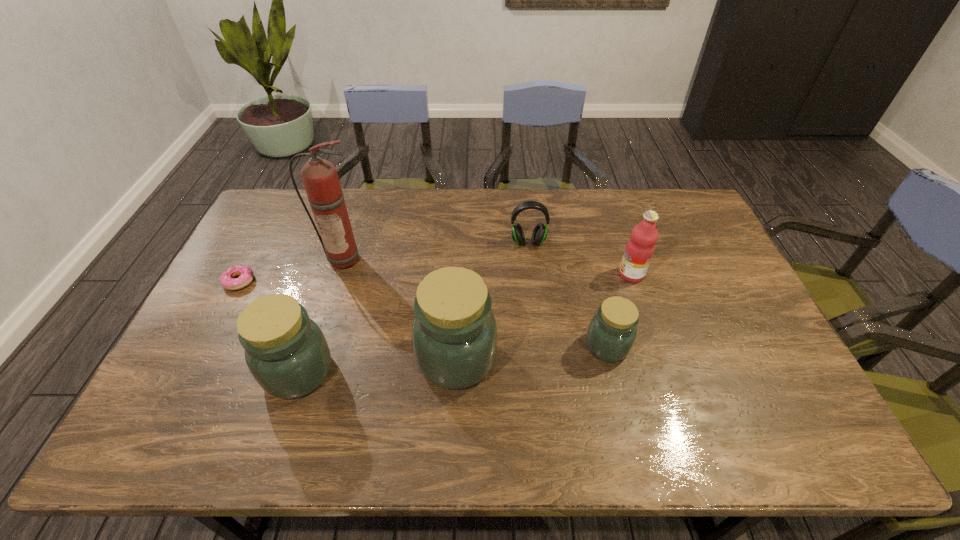
Locate an element on the screen. vacant space situated on the left of the second jar from right to left is located at coordinates (271, 358).

The image size is (960, 540). In order to click on vacant area situated on the left of the rightmost jar in this screenshot , I will do click(555, 346).

The width and height of the screenshot is (960, 540). In order to click on free space located on the side of the fire extinguisher with the label and nozzle in this screenshot , I will do `click(317, 351)`.

You are a GUI agent. You are given a task and a screenshot of the screen. Output one action in this format:
    pyautogui.click(x=<x>, y=<y>)
    Task: Click on the free region located 0.400m on the ear cups of the fifth object from left to right
    
    Given the screenshot: What is the action you would take?
    pyautogui.click(x=540, y=352)

The height and width of the screenshot is (540, 960). What are the coordinates of `vacant region located 0.150m on the right of the doughnut` in the screenshot? It's located at coord(303,281).

Locate an element on the screen. The height and width of the screenshot is (540, 960). free location located on the label of the rightmost object is located at coordinates (603, 274).

At what (x,y) coordinates should I click in order to perform the action: click on free point located on the label of the rightmost object. Please return your answer as a coordinate pair (x, y). Image resolution: width=960 pixels, height=540 pixels. Looking at the image, I should click on (564, 274).

This screenshot has height=540, width=960. I want to click on blank space located on the label of the rightmost object, so click(499, 274).

At what (x,y) coordinates should I click in order to perform the action: click on object positioned at the left edge. Please return your answer as a coordinate pair (x, y). Image resolution: width=960 pixels, height=540 pixels. Looking at the image, I should click on (245, 273).

This screenshot has height=540, width=960. In the image, there is a desktop. Find the location of `vacant area at the far edge`. vacant area at the far edge is located at coordinates (396, 214).